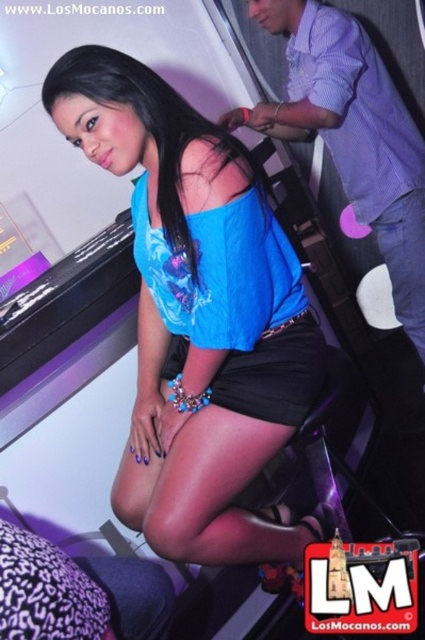
You are a photographer setting up for a photoshoot and need to ensure proper lighting. Given the blue satin dress at center and the purple checkered shirt at upper right are 26.88 inches apart, what is the minimum distance your lighting equipment should cover to illuminate both objects adequately?

The blue satin dress at center and the purple checkered shirt at upper right are 26.88 inches apart. To ensure both are illuminated adequately, the lighting equipment should cover at least 26.88 inches between them.